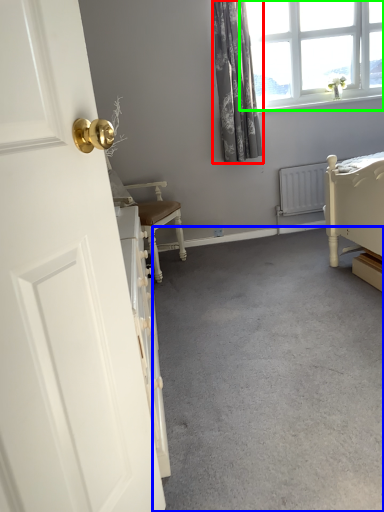
Question: Estimate the real-world distances between objects in this image. Which object is farther from curtain (highlighted by a red box), concrete (highlighted by a blue box) or window (highlighted by a green box)?

Choices:
 (A) concrete
 (B) window

Answer: (A)